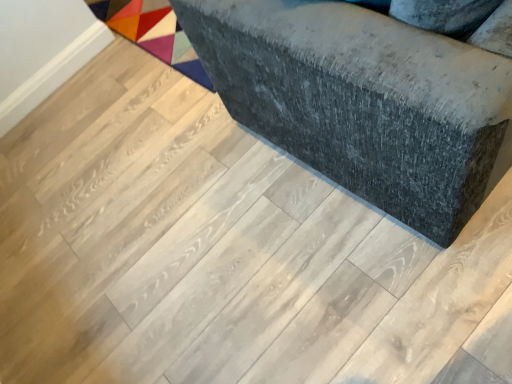
Question: Visually, is dark gray fabric ottoman at center positioned to the left or to the right of multicolored fabric mat at upper left?

Choices:
 (A) right
 (B) left

Answer: (A)

Question: Considering the positions of dark gray fabric ottoman at center and multicolored fabric mat at upper left in the image, is dark gray fabric ottoman at center bigger or smaller than multicolored fabric mat at upper left?

Choices:
 (A) small
 (B) big

Answer: (B)

Question: Is dark gray fabric ottoman at center in front of or behind multicolored fabric mat at upper left in the image?

Choices:
 (A) behind
 (B) front

Answer: (B)

Question: Based on their positions, is multicolored fabric mat at upper left located to the left or right of dark gray fabric ottoman at center?

Choices:
 (A) right
 (B) left

Answer: (B)

Question: From a real-world perspective, is multicolored fabric mat at upper left physically located above or below dark gray fabric ottoman at center?

Choices:
 (A) below
 (B) above

Answer: (A)

Question: Which is correct: multicolored fabric mat at upper left is inside dark gray fabric ottoman at center, or outside of it?

Choices:
 (A) outside
 (B) inside

Answer: (A)

Question: Looking at the image, does multicolored fabric mat at upper left seem bigger or smaller compared to dark gray fabric ottoman at center?

Choices:
 (A) small
 (B) big

Answer: (A)